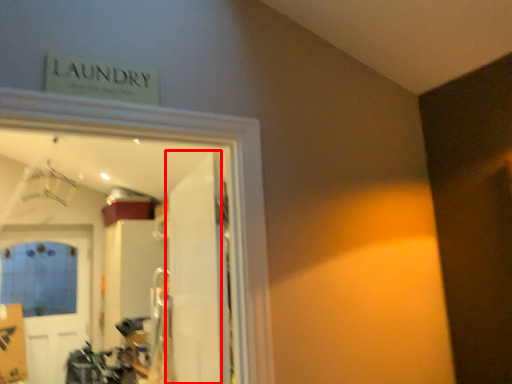
Question: In this image, where is door (annotated by the red box) located relative to door?

Choices:
 (A) right
 (B) left

Answer: (A)